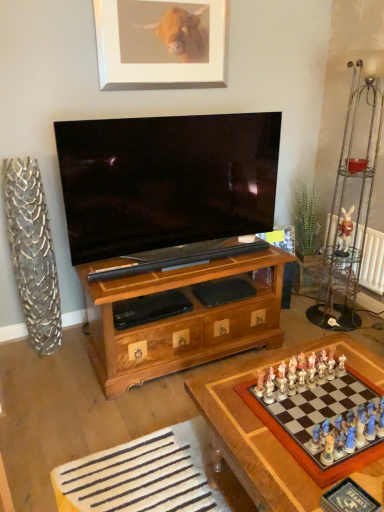
Question: From a real-world perspective, is wooden chessboard at lower right on white ceramic rabbit at upper right?

Choices:
 (A) yes
 (B) no

Answer: (B)

Question: Considering the relative sizes of wooden chessboard at lower right and white ceramic rabbit at upper right in the image provided, is wooden chessboard at lower right wider than white ceramic rabbit at upper right?

Choices:
 (A) yes
 (B) no

Answer: (A)

Question: Is wooden chessboard at lower right touching white ceramic rabbit at upper right?

Choices:
 (A) yes
 (B) no

Answer: (B)

Question: From the image's perspective, is wooden chessboard at lower right above white ceramic rabbit at upper right?

Choices:
 (A) no
 (B) yes

Answer: (A)

Question: Considering the relative sizes of wooden chessboard at lower right and white ceramic rabbit at upper right in the image provided, is wooden chessboard at lower right thinner than white ceramic rabbit at upper right?

Choices:
 (A) yes
 (B) no

Answer: (B)

Question: Considering the positions of silver metallic picture frame at upper center and white ceramic rabbit at upper right in the image, is silver metallic picture frame at upper center taller or shorter than white ceramic rabbit at upper right?

Choices:
 (A) short
 (B) tall

Answer: (B)

Question: Considering the positions of silver metallic picture frame at upper center and white ceramic rabbit at upper right in the image, is silver metallic picture frame at upper center bigger or smaller than white ceramic rabbit at upper right?

Choices:
 (A) big
 (B) small

Answer: (A)

Question: From the image's perspective, is silver metallic picture frame at upper center located above or below white ceramic rabbit at upper right?

Choices:
 (A) below
 (B) above

Answer: (B)

Question: From a real-world perspective, is silver metallic picture frame at upper center physically located above or below white ceramic rabbit at upper right?

Choices:
 (A) below
 (B) above

Answer: (B)

Question: Is wooden chessboard at lower right spatially inside white radiator at right, or outside of it?

Choices:
 (A) inside
 (B) outside

Answer: (B)

Question: From the image's perspective, is wooden chessboard at lower right located above or below white radiator at right?

Choices:
 (A) above
 (B) below

Answer: (B)

Question: Is point (380, 391) closer or farther from the camera than point (374, 278)?

Choices:
 (A) closer
 (B) farther

Answer: (A)

Question: Visually, is wooden chessboard at lower right positioned to the left or to the right of white radiator at right?

Choices:
 (A) left
 (B) right

Answer: (A)

Question: From the image's perspective, is white ceramic rabbit at upper right above or below white radiator at right?

Choices:
 (A) above
 (B) below

Answer: (A)

Question: Considering the positions of white ceramic rabbit at upper right and white radiator at right in the image, is white ceramic rabbit at upper right taller or shorter than white radiator at right?

Choices:
 (A) tall
 (B) short

Answer: (B)